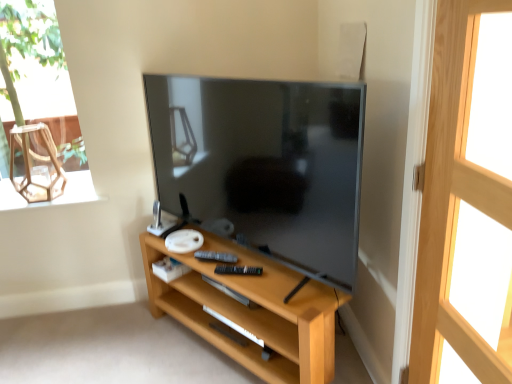
The image size is (512, 384). Identify the location of vacant area that is in front of black plastic remote at center. (228, 273).